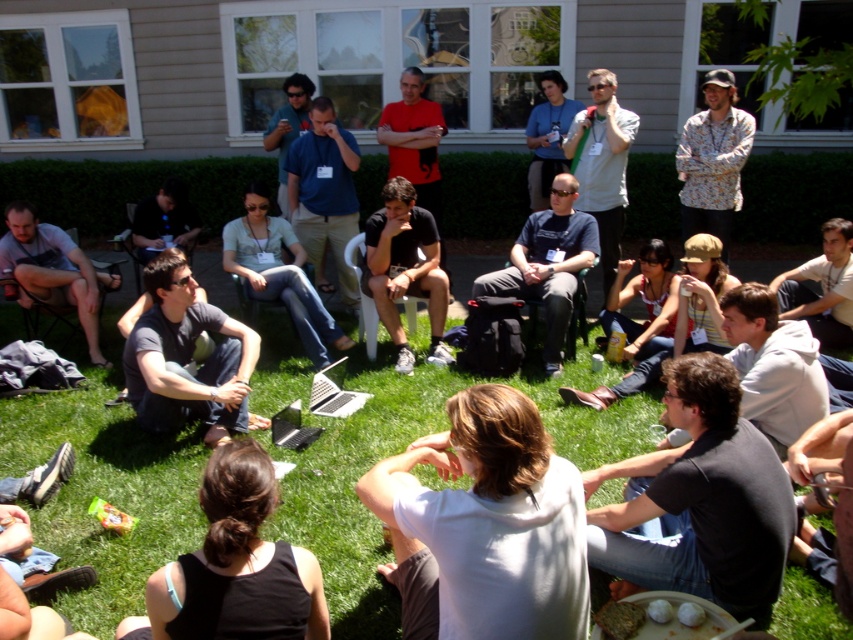
Can you confirm if white cotton shirt at center is taller than light blue denim jeans at center?

In fact, white cotton shirt at center may be shorter than light blue denim jeans at center.

Which of these two, white cotton shirt at center or light blue denim jeans at center, stands shorter?

With less height is white cotton shirt at center.

Is point (428, 522) in front of point (270, 240)?

Yes, point (428, 522) is in front of point (270, 240).

Locate an element on the screen. The height and width of the screenshot is (640, 853). white cotton shirt at center is located at coordinates (489, 528).

Does green grass at lower center have a lesser width compared to white shirt at center?

No.

Which is in front, point (405, 394) or point (837, 275)?

Point (405, 394) is more forward.

What do you see at coordinates (103, 488) in the screenshot?
I see `green grass at lower center` at bounding box center [103, 488].

This screenshot has width=853, height=640. In order to click on green grass at lower center in this screenshot , I will do `click(103, 488)`.

Where is `black matte shirt at lower right`? This screenshot has height=640, width=853. black matte shirt at lower right is located at coordinates [x=698, y=500].

Is the position of black matte shirt at lower right less distant than that of blue shirt at center?

Yes, it is.

Is point (711, 529) positioned before point (314, 227)?

Yes, point (711, 529) is in front of point (314, 227).

Locate an element on the screen. This screenshot has height=640, width=853. black matte shirt at lower right is located at coordinates (698, 500).